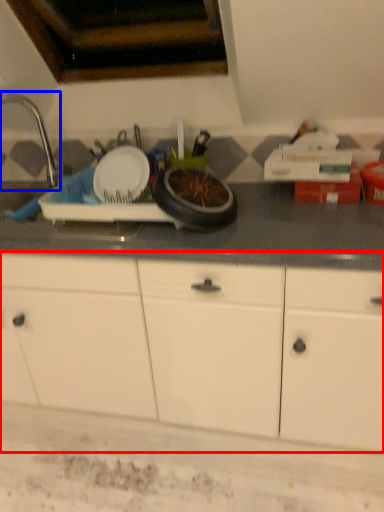
Question: Which object is further to the camera taking this photo, cabinetry (highlighted by a red box) or faucet (highlighted by a blue box)?

Choices:
 (A) cabinetry
 (B) faucet

Answer: (B)